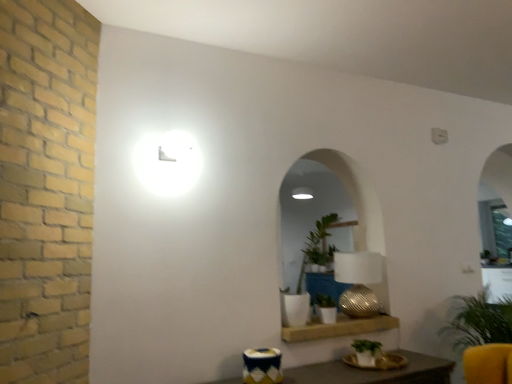
Question: From the image's perspective, is green matte plant at lower center, which appears as the 3th houseplant when viewed from the left, above textured gold table lamp at center?

Choices:
 (A) yes
 (B) no

Answer: (B)

Question: Is there a large distance between green matte plant at lower center, the second houseplant from the right, and textured gold table lamp at center?

Choices:
 (A) no
 (B) yes

Answer: (A)

Question: Is green matte plant at lower center, which appears as the 3th houseplant when viewed from the left, thinner than textured gold table lamp at center?

Choices:
 (A) no
 (B) yes

Answer: (B)

Question: Does green matte plant at lower center, which appears as the 3th houseplant when viewed from the left, have a greater width compared to textured gold table lamp at center?

Choices:
 (A) no
 (B) yes

Answer: (A)

Question: Is green matte plant at lower center, which appears as the 3th houseplant when viewed from the left, with textured gold table lamp at center?

Choices:
 (A) yes
 (B) no

Answer: (B)

Question: Is textured gold table lamp at center a part of green matte plant at lower center, which appears as the 3th houseplant when viewed from the left?

Choices:
 (A) no
 (B) yes

Answer: (A)

Question: Does green matte plant at lower center, which appears as the 3th houseplant when viewed from the left, come in front of wooden shelf at lower center?

Choices:
 (A) yes
 (B) no

Answer: (A)

Question: Is green matte plant at lower center, which appears as the 3th houseplant when viewed from the left, located outside wooden shelf at lower center?

Choices:
 (A) no
 (B) yes

Answer: (B)

Question: From the image's perspective, does green matte plant at lower center, the second houseplant from the right, appear higher than wooden shelf at lower center?

Choices:
 (A) yes
 (B) no

Answer: (B)

Question: Is wooden shelf at lower center at the back of green matte plant at lower center, the second houseplant from the right?

Choices:
 (A) no
 (B) yes

Answer: (B)

Question: Would you say green matte plant at lower center, the second houseplant from the right, contains wooden shelf at lower center?

Choices:
 (A) yes
 (B) no

Answer: (B)

Question: Can you confirm if green matte plant at lower center, the second houseplant from the right, is shorter than wooden shelf at lower center?

Choices:
 (A) yes
 (B) no

Answer: (B)

Question: Does green leafy plant at right, positioned as the fourth houseplant in left-to-right order, have a greater height compared to green matte plant at lower center, which appears as the 3th houseplant when viewed from the left?

Choices:
 (A) no
 (B) yes

Answer: (B)